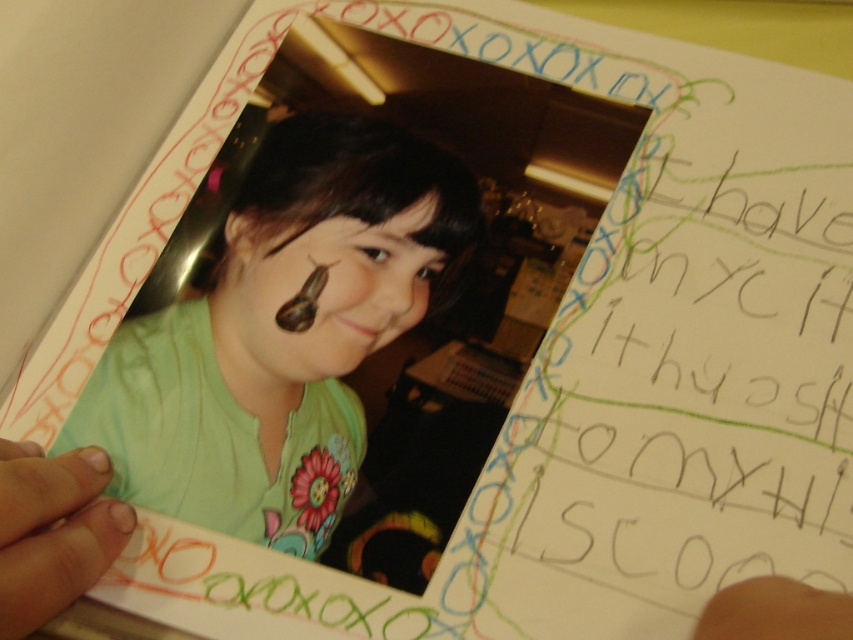
You are an artist trying to sketch the scene from the image. If your drawing paper is 20 inches wide, will the green matte shirt at center fit horizontally on your paper?

The green matte shirt at center is 18.18 inches away from the viewer, so it will fit horizontally on a 20 inch wide drawing paper since its distance is less than the paper width.

You are looking at the paper with the photograph and the two points marked on it. Which of the two points, point (x=260, y=163) or point (x=239, y=225), is closer to the edge of the paper?

The question cannot be answered based on the provided information because the description only states the relative distance to the camera between the two points, not their positions relative to the paper edges.